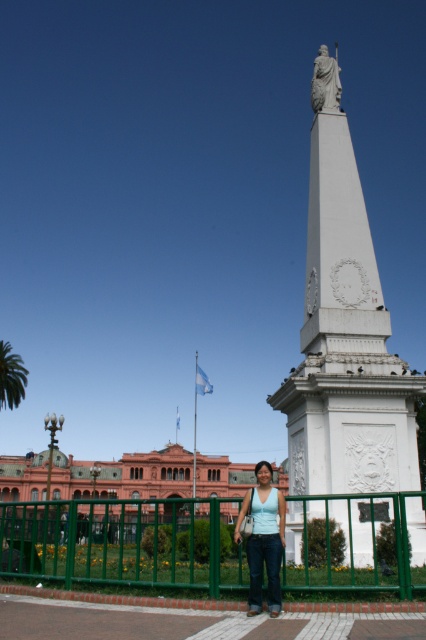
You are a photographer planning to take a wide shot of the monument. You need to ensure that both the white marble obelisk at center and the white marble statue at upper center are fully visible in the frame. Considering their widths, which one might require you to adjust your camera angle to avoid cropping?

The white marble obelisk at center is wider than the white marble statue at upper center, so you might need to adjust your camera angle to ensure the obelisk fits without cropping.